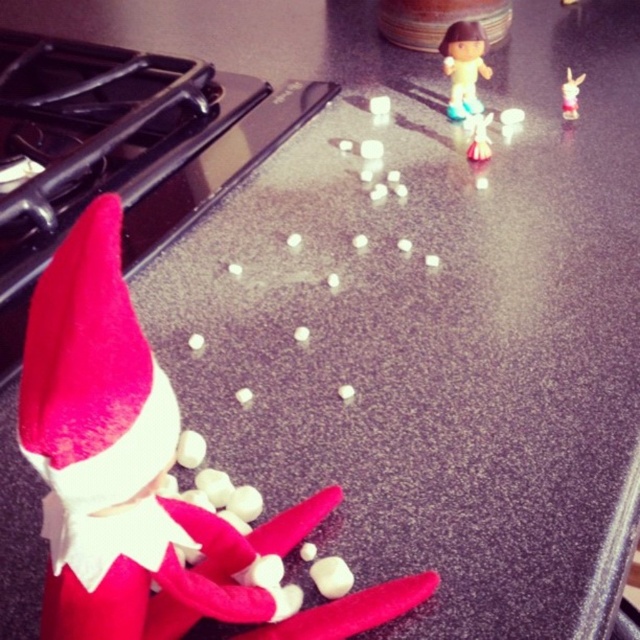
Looking at this image, you are a chef preparing a dessert display and see the felt red elf at lower left and the matte plastic figurine at upper center. Which object is taller and needs to be considered for stability when arranging the marshmallows?

The felt red elf at lower left is much taller than the matte plastic figurine at upper center, so it needs to be considered for stability when arranging the marshmallows.

You are a child who wants to place the smooth plastic doll at upper center exactly halfway between the red plush toy on the left and the heart shape made of marshmallows in the middle. Can you do it?

The distance between the red plush toy on the left and the heart shape made of marshmallows in the middle is 36.91 inches. Half of that distance is 18.455 inches. Place the smooth plastic doll at upper center 18.455 inches from either the red plush toy on the left or the heart shape made of marshmallows in the middle to achieve the halfway point.